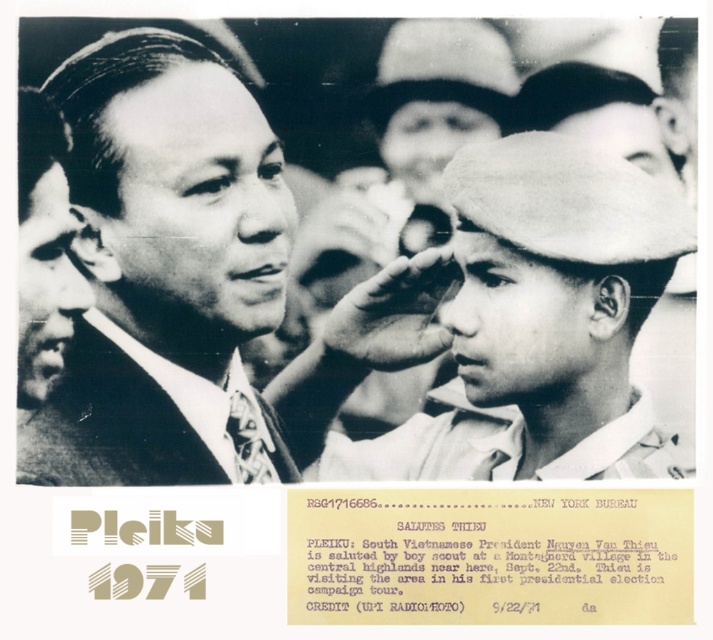
Does smooth black suit at center come behind white felt hat at center?

Yes.

I want to click on smooth black suit at center, so (165, 269).

You are a GUI agent. You are given a task and a screenshot of the screen. Output one action in this format:
    pyautogui.click(x=<x>, y=<y>)
    Task: Click on the smooth black suit at center
    Image resolution: width=713 pixels, height=640 pixels.
    Given the screenshot: What is the action you would take?
    pyautogui.click(x=165, y=269)

Describe the element at coordinates (540, 321) in the screenshot. I see `white felt hat at center` at that location.

Between white felt hat at center and white cotton shirt at center, which one appears on the left side from the viewer's perspective?

white cotton shirt at center

Measure the distance between point (x=486, y=276) and camera.

5.48 feet

Locate an element on the screen. This screenshot has width=713, height=640. white felt hat at center is located at coordinates (540, 321).

Is smooth black suit at center shorter than patterned fabric tie at left?

In fact, smooth black suit at center may be taller than patterned fabric tie at left.

Can you confirm if smooth black suit at center is wider than patterned fabric tie at left?

Incorrect, smooth black suit at center's width does not surpass patterned fabric tie at left's.

This screenshot has height=640, width=713. In order to click on smooth black suit at center in this screenshot , I will do pos(165,269).